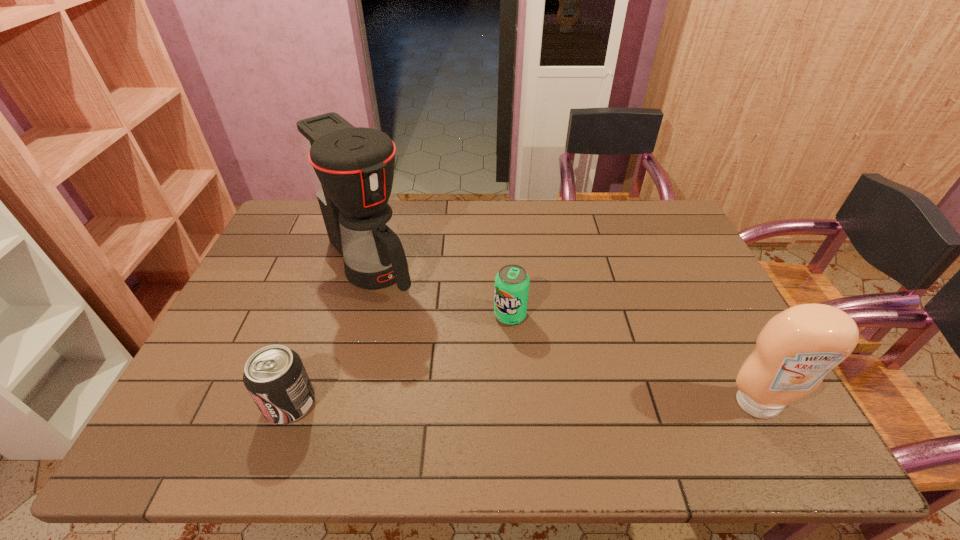
Where is `the left pop soda`? This screenshot has height=540, width=960. the left pop soda is located at coordinates (275, 377).

This screenshot has width=960, height=540. Find the location of `the second tallest object`. the second tallest object is located at coordinates (796, 349).

Image resolution: width=960 pixels, height=540 pixels. I want to click on condiment, so click(796, 349).

At what (x,y) coordinates should I click in order to perform the action: click on coffee maker. Please return your answer as a coordinate pair (x, y). Looking at the image, I should click on pyautogui.click(x=352, y=168).

This screenshot has height=540, width=960. I want to click on the farther pop soda, so click(512, 282).

In order to click on the right pop soda in this screenshot , I will do `click(512, 282)`.

Where is `free region located on the right of the nearer pop soda`? Image resolution: width=960 pixels, height=540 pixels. free region located on the right of the nearer pop soda is located at coordinates (471, 403).

Locate an element on the screen. free space located 0.140m pour from the carafe of the coffee maker is located at coordinates (420, 326).

Image resolution: width=960 pixels, height=540 pixels. What are the coordinates of `vacant region located pour from the carafe of the coffee maker` in the screenshot? It's located at (402, 307).

Where is `vacant space located pour from the carafe of the coffee maker`? vacant space located pour from the carafe of the coffee maker is located at coordinates (420, 326).